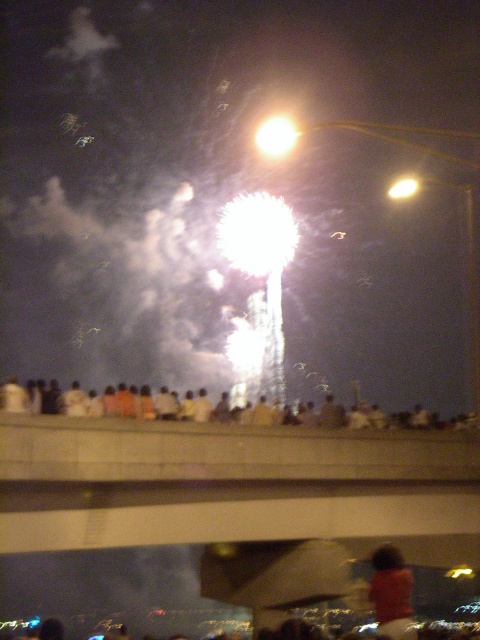
You are standing at the scene and want to take a photo of the fireworks. You notice two people in the foreground wearing a white cotton shirt at lower center and an orange fabric shirt at center. Which person would block your view of the fireworks more?

The white cotton shirt at lower center is much taller than the orange fabric shirt at center, so it would block your view of the fireworks more.

You are standing at point (x=311, y=412) and want to reach the fireworks display. The distance between you and the fireworks is 39.90 meters. If you walk at a speed of 1.5 meters per second, how many seconds will it take you to reach the fireworks?

The distance between you and the fireworks is 39.90 meters. At a speed of 1.5 meters per second, it will take approximately 26.6 seconds to reach the fireworks.

In the scene shown: You are standing on a bridge watching fireworks with two people nearby. One is wearing a white cotton shirt at lower center, and the other has an orange fabric shirt at center. If you want to hand a souvenir to both of them without moving, which one is closer to you?

The white cotton shirt at lower center is closer to you than the orange fabric shirt at center since they are 10.89 meters apart.